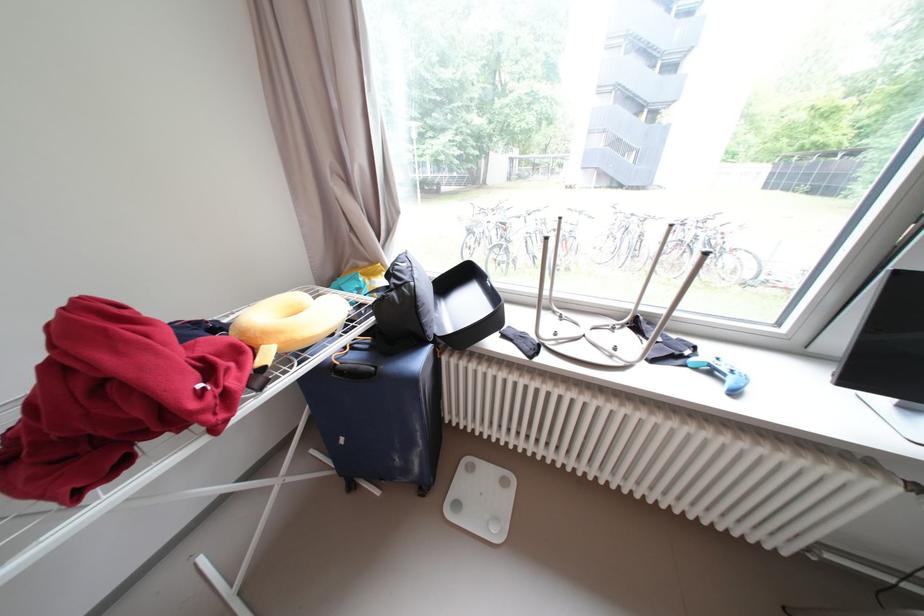
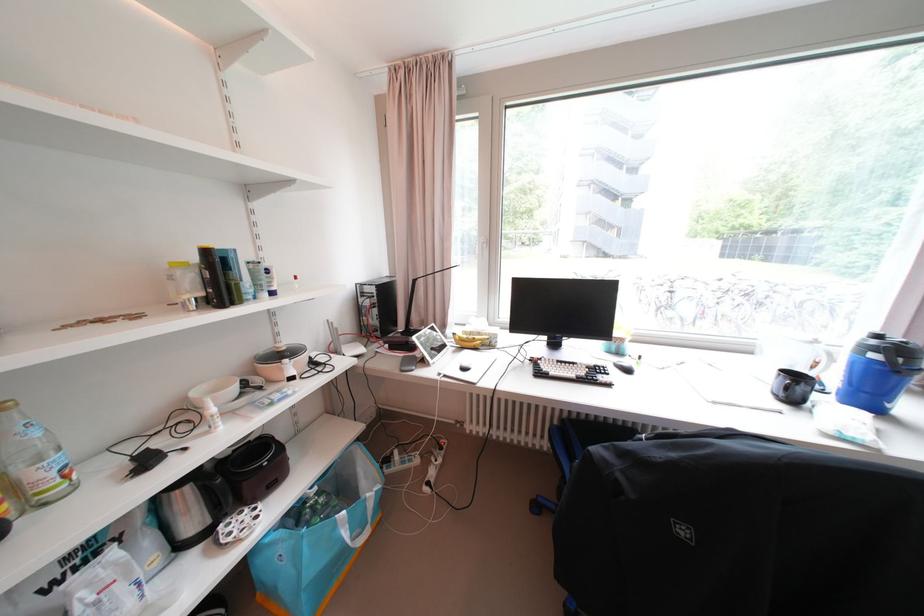
Question: Which direction would the cameraman need to move to produce the second image? Reply with the corresponding letter.

Choices:
 (A) Left
 (B) Right
 (C) Forward
 (D) Backward

Answer: (A)